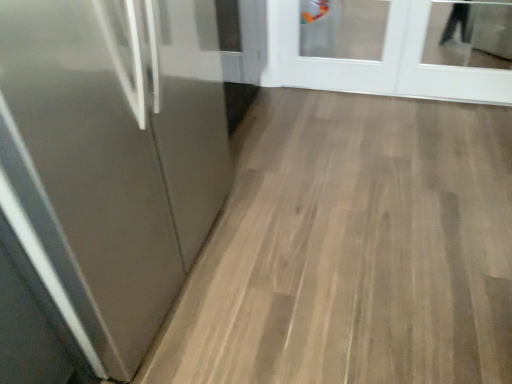
This screenshot has height=384, width=512. Describe the element at coordinates (381, 61) in the screenshot. I see `white glossy door at upper right, which appears as the first door when viewed from the right` at that location.

Where is `white glossy door at upper right, which appears as the first door when viewed from the right`? The width and height of the screenshot is (512, 384). white glossy door at upper right, which appears as the first door when viewed from the right is located at coordinates (381, 61).

Image resolution: width=512 pixels, height=384 pixels. Describe the element at coordinates (112, 158) in the screenshot. I see `glossy metallic door at left, the 2th door positioned from the right` at that location.

Find the location of a particular element. glossy metallic door at left, placed as the 1th door when sorted from left to right is located at coordinates (112, 158).

Identify the location of white glossy door at upper right, the 2th door when ordered from front to back. The width and height of the screenshot is (512, 384). (381, 61).

Does glossy metallic door at left, which ranks as the first door in front-to-back order, appear on the left side of white glossy door at upper right, which appears as the first door when viewed from the right?

Correct, you'll find glossy metallic door at left, which ranks as the first door in front-to-back order, to the left of white glossy door at upper right, which appears as the first door when viewed from the right.

Which object is closer to the camera taking this photo, glossy metallic door at left, which ranks as the first door in front-to-back order, or white glossy door at upper right, the 2th door when ordered from front to back?

glossy metallic door at left, which ranks as the first door in front-to-back order, is in front.

Does point (140, 250) come behind point (389, 32)?

No, it is not.

From the image's perspective, is glossy metallic door at left, which ranks as the first door in front-to-back order, beneath white glossy door at upper right, the second door positioned from the left?

Correct, glossy metallic door at left, which ranks as the first door in front-to-back order, appears lower than white glossy door at upper right, the second door positioned from the left, in the image.

From a real-world perspective, relative to white glossy door at upper right, which appears as the 1th door when viewed from the back, is glossy metallic door at left, the 2th door positioned from the right, vertically above or below?

glossy metallic door at left, the 2th door positioned from the right, is above white glossy door at upper right, which appears as the 1th door when viewed from the back.

Can you confirm if glossy metallic door at left, placed as the 1th door when sorted from left to right, is wider than white glossy door at upper right, the second door positioned from the left?

Yes.

Between glossy metallic door at left, which is the 2th door in back-to-front order, and white glossy door at upper right, the second door positioned from the left, which one has less height?

Standing shorter between the two is white glossy door at upper right, the second door positioned from the left.

Considering the relative sizes of glossy metallic door at left, placed as the 1th door when sorted from left to right, and white glossy door at upper right, which appears as the first door when viewed from the right, in the image provided, is glossy metallic door at left, placed as the 1th door when sorted from left to right, bigger than white glossy door at upper right, which appears as the first door when viewed from the right,?

Yes, glossy metallic door at left, placed as the 1th door when sorted from left to right, is bigger than white glossy door at upper right, which appears as the first door when viewed from the right.

Is glossy metallic door at left, the 2th door positioned from the right, outside of white glossy door at upper right, which appears as the first door when viewed from the right?

Indeed, glossy metallic door at left, the 2th door positioned from the right, is completely outside white glossy door at upper right, which appears as the first door when viewed from the right.

Is there a large distance between glossy metallic door at left, which is the 2th door in back-to-front order, and white glossy door at upper right, the second door positioned from the left?

Yes, glossy metallic door at left, which is the 2th door in back-to-front order, and white glossy door at upper right, the second door positioned from the left, are located far from each other.

Is glossy metallic door at left, the 2th door positioned from the right, looking in the opposite direction of white glossy door at upper right, the second door positioned from the left?

glossy metallic door at left, the 2th door positioned from the right, is not turned away from white glossy door at upper right, the second door positioned from the left.

What's the angular difference between glossy metallic door at left, which ranks as the first door in front-to-back order, and white glossy door at upper right, the second door positioned from the left,'s facing directions?

90.5 degrees separate the facing orientations of glossy metallic door at left, which ranks as the first door in front-to-back order, and white glossy door at upper right, the second door positioned from the left.

Measure the distance from glossy metallic door at left, the 2th door positioned from the right, to white glossy door at upper right, which appears as the 1th door when viewed from the back.

A distance of 5.28 feet exists between glossy metallic door at left, the 2th door positioned from the right, and white glossy door at upper right, which appears as the 1th door when viewed from the back.

Locate an element on the screen. This screenshot has width=512, height=384. door below the glossy metallic door at left, which ranks as the first door in front-to-back order (from a real-world perspective) is located at coordinates (381, 61).

Considering the relative positions of white glossy door at upper right, the 2th door when ordered from front to back, and glossy metallic door at left, which ranks as the first door in front-to-back order, in the image provided, is white glossy door at upper right, the 2th door when ordered from front to back, to the right of glossy metallic door at left, which ranks as the first door in front-to-back order, from the viewer's perspective?

Indeed, white glossy door at upper right, the 2th door when ordered from front to back, is positioned on the right side of glossy metallic door at left, which ranks as the first door in front-to-back order.

Is white glossy door at upper right, which appears as the first door when viewed from the right, positioned in front of glossy metallic door at left, the 2th door positioned from the right?

No, white glossy door at upper right, which appears as the first door when viewed from the right, is further to the viewer.

Considering the positions of point (400, 79) and point (12, 18), is point (400, 79) closer or farther from the camera than point (12, 18)?

Clearly, point (400, 79) is more distant from the camera than point (12, 18).

From the image's perspective, relative to glossy metallic door at left, the 2th door positioned from the right, is white glossy door at upper right, the 2th door when ordered from front to back, above or below?

Based on their image positions, white glossy door at upper right, the 2th door when ordered from front to back, is located above glossy metallic door at left, the 2th door positioned from the right.

From a real-world perspective, is white glossy door at upper right, the second door positioned from the left, positioned above or below glossy metallic door at left, the 2th door positioned from the right?

white glossy door at upper right, the second door positioned from the left, is situated lower than glossy metallic door at left, the 2th door positioned from the right, in the real world.

Which of these two, white glossy door at upper right, which appears as the 1th door when viewed from the back, or glossy metallic door at left, the 2th door positioned from the right, is wider?

With larger width is glossy metallic door at left, the 2th door positioned from the right.

Is white glossy door at upper right, which appears as the 1th door when viewed from the back, shorter than glossy metallic door at left, which ranks as the first door in front-to-back order?

Indeed, white glossy door at upper right, which appears as the 1th door when viewed from the back, has a lesser height compared to glossy metallic door at left, which ranks as the first door in front-to-back order.

Based on their sizes in the image, would you say white glossy door at upper right, which appears as the 1th door when viewed from the back, is bigger or smaller than glossy metallic door at left, placed as the 1th door when sorted from left to right?

In the image, white glossy door at upper right, which appears as the 1th door when viewed from the back, appears to be smaller than glossy metallic door at left, placed as the 1th door when sorted from left to right.

Is white glossy door at upper right, the 2th door when ordered from front to back, located outside glossy metallic door at left, placed as the 1th door when sorted from left to right?

Yes, white glossy door at upper right, the 2th door when ordered from front to back, is located beyond the bounds of glossy metallic door at left, placed as the 1th door when sorted from left to right.

Is white glossy door at upper right, the second door positioned from the left, with glossy metallic door at left, the 2th door positioned from the right?

No, white glossy door at upper right, the second door positioned from the left, is not beside glossy metallic door at left, the 2th door positioned from the right.

Is white glossy door at upper right, which appears as the first door when viewed from the right, aimed at glossy metallic door at left, which is the 2th door in back-to-front order?

Yes, white glossy door at upper right, which appears as the first door when viewed from the right, faces towards glossy metallic door at left, which is the 2th door in back-to-front order.

Can you tell me how much white glossy door at upper right, which appears as the first door when viewed from the right, and glossy metallic door at left, which ranks as the first door in front-to-back order, differ in facing direction?

The facing directions of white glossy door at upper right, which appears as the first door when viewed from the right, and glossy metallic door at left, which ranks as the first door in front-to-back order, are 90.5 degrees apart.

Locate an element on the screen. The height and width of the screenshot is (384, 512). door above the glossy metallic door at left, which ranks as the first door in front-to-back order (from the image's perspective) is located at coordinates (381, 61).

What are the coordinates of `door below the glossy metallic door at left, the 2th door positioned from the right (from a real-world perspective)` in the screenshot? It's located at (381, 61).

Find the location of a particular element. door above the white glossy door at upper right, the second door positioned from the left (from a real-world perspective) is located at coordinates (112, 158).